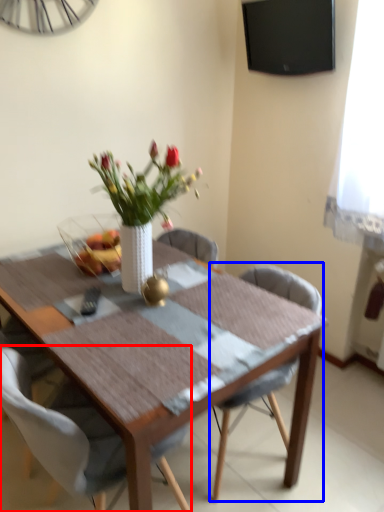
Question: Which point is closer to the camera, chair (highlighted by a red box) or chair (highlighted by a blue box)?

Choices:
 (A) chair
 (B) chair

Answer: (A)